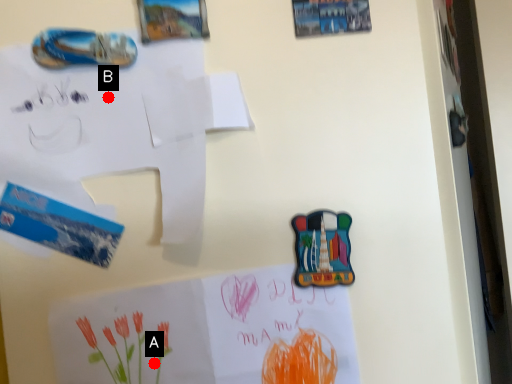
Question: Two points are circled on the image, labeled by A and B beside each circle. Among these points, which one is farthest from the camera?

Choices:
 (A) A is further
 (B) B is further

Answer: (B)